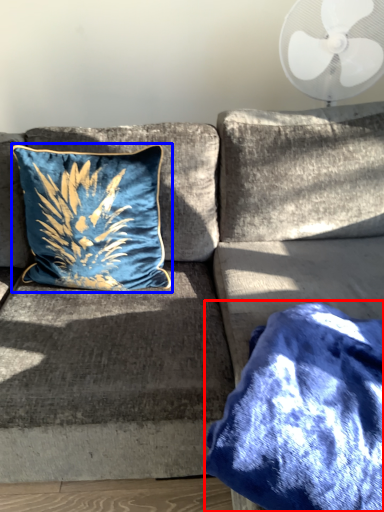
Question: Which point is further to the camera, blanket (highlighted by a red box) or pillow (highlighted by a blue box)?

Choices:
 (A) blanket
 (B) pillow

Answer: (B)